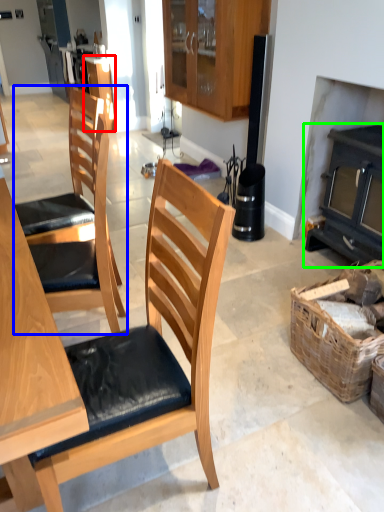
Question: Which is farther away from cabinetry (highlighted by a red box)? chair (highlighted by a blue box) or fireplace (highlighted by a green box)?

Choices:
 (A) chair
 (B) fireplace

Answer: (B)